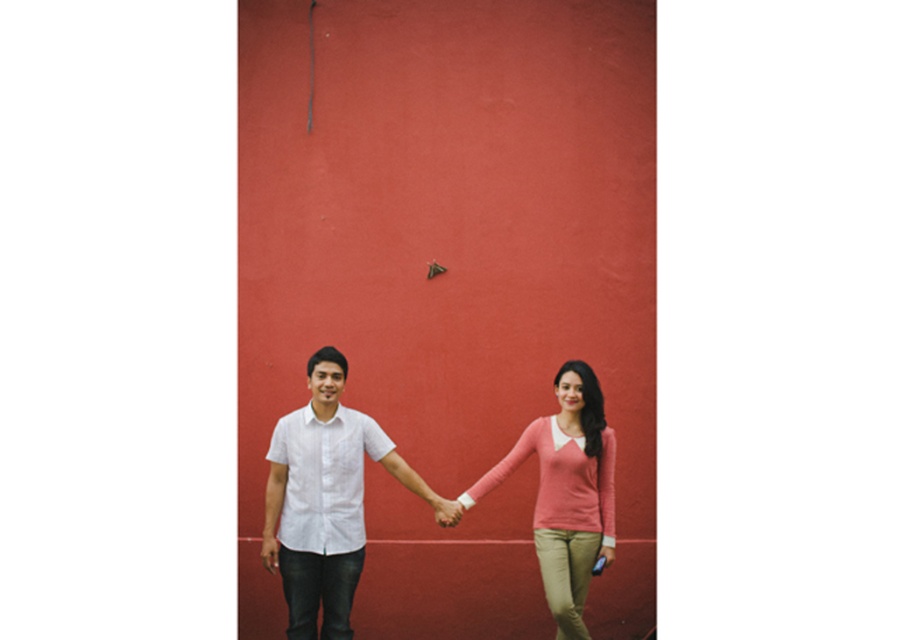
Does white cotton shirt at center come in front of matte pink hand at center?

Yes, it is in front of matte pink hand at center.

Does white cotton shirt at center have a greater height compared to matte pink hand at center?

Indeed, white cotton shirt at center has a greater height compared to matte pink hand at center.

Image resolution: width=897 pixels, height=640 pixels. In order to click on white cotton shirt at center in this screenshot , I will do `click(323, 500)`.

What do you see at coordinates (565, 492) in the screenshot?
I see `pink sweater at center` at bounding box center [565, 492].

Can you confirm if pink sweater at center is positioned to the left of matte pink hand at center?

Incorrect, pink sweater at center is not on the left side of matte pink hand at center.

Measure the distance between point (x=594, y=388) and camera.

Point (x=594, y=388) is 5.46 meters away from camera.

Image resolution: width=897 pixels, height=640 pixels. What are the coordinates of `pink sweater at center` in the screenshot? It's located at (565, 492).

Is white cotton shirt at center above pink sweater at center?

Incorrect, white cotton shirt at center is not positioned above pink sweater at center.

In the scene shown: Can you confirm if white cotton shirt at center is smaller than pink sweater at center?

Yes.

Between point (285, 596) and point (585, 472), which one is positioned in front?

Positioned in front is point (285, 596).

The height and width of the screenshot is (640, 897). I want to click on white cotton shirt at center, so click(x=323, y=500).